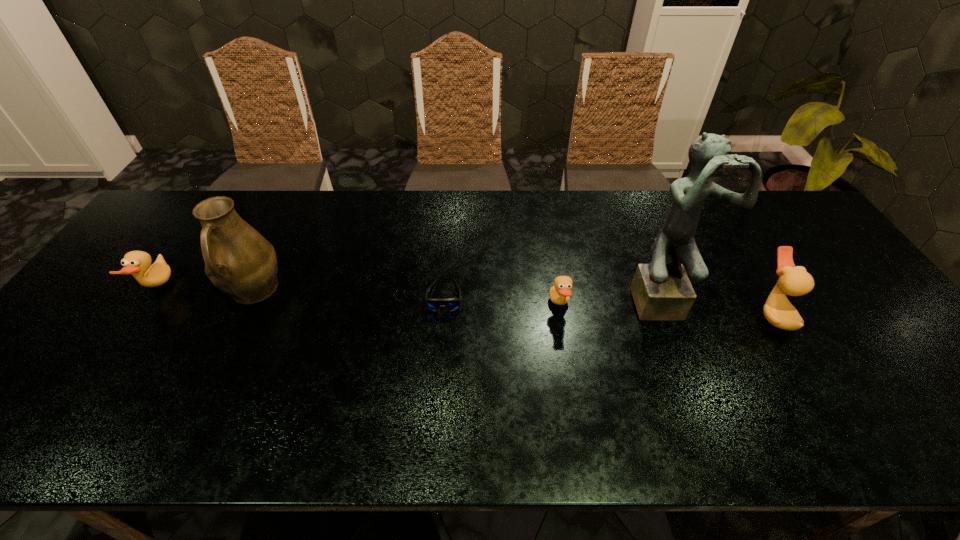
The height and width of the screenshot is (540, 960). I want to click on object that is positioned at the left edge, so click(x=137, y=263).

You are a GUI agent. You are given a task and a screenshot of the screen. Output one action in this format:
    pyautogui.click(x=<x>, y=<y>)
    Task: Click on the vacant area at the far edge
    The image size is (960, 540).
    Given the screenshot: What is the action you would take?
    pyautogui.click(x=380, y=193)

In the image, there is a desktop. Identify the location of free space at the near edge. This screenshot has width=960, height=540. (750, 380).

Identify the location of vacant space at the left edge. Image resolution: width=960 pixels, height=540 pixels. (134, 284).

In the image, there is a desktop. In order to click on free space at the right edge in this screenshot , I will do `click(817, 308)`.

Locate an element on the screen. Image resolution: width=960 pixels, height=540 pixels. free space between the pitcher and the tallest duck is located at coordinates (513, 302).

Where is `free space between the fifth object from left to right and the fourth tallest object`? free space between the fifth object from left to right and the fourth tallest object is located at coordinates (409, 293).

Image resolution: width=960 pixels, height=540 pixels. Find the location of `free space between the rightmost object and the shortest object`. free space between the rightmost object and the shortest object is located at coordinates (609, 305).

Locate an element on the screen. The width and height of the screenshot is (960, 540). vacant space that's between the third object from left to right and the leftmost duck is located at coordinates (300, 292).

I want to click on unoccupied position between the fifth object from right to left and the sunglasses, so click(x=348, y=293).